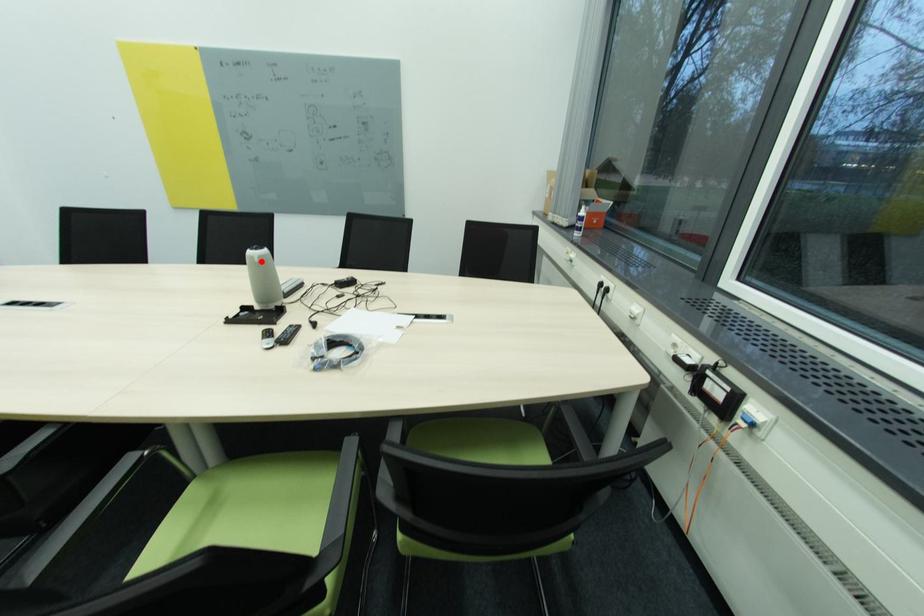
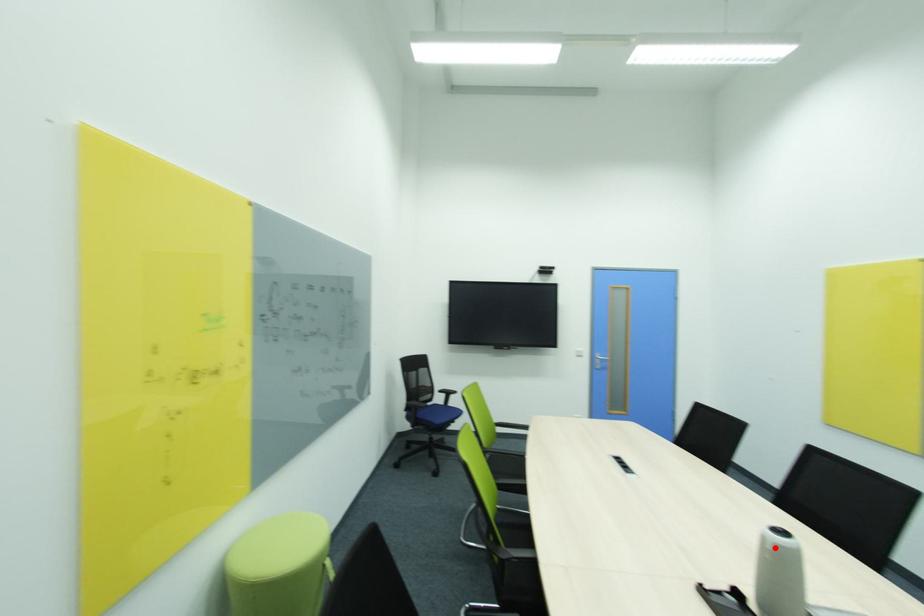
I am providing you with two images of the same scene from different viewpoints. A red point is marked on the first image and another point is marked on the second image. Does the point marked in image1 correspond to the same location as the one in image2?

Yes